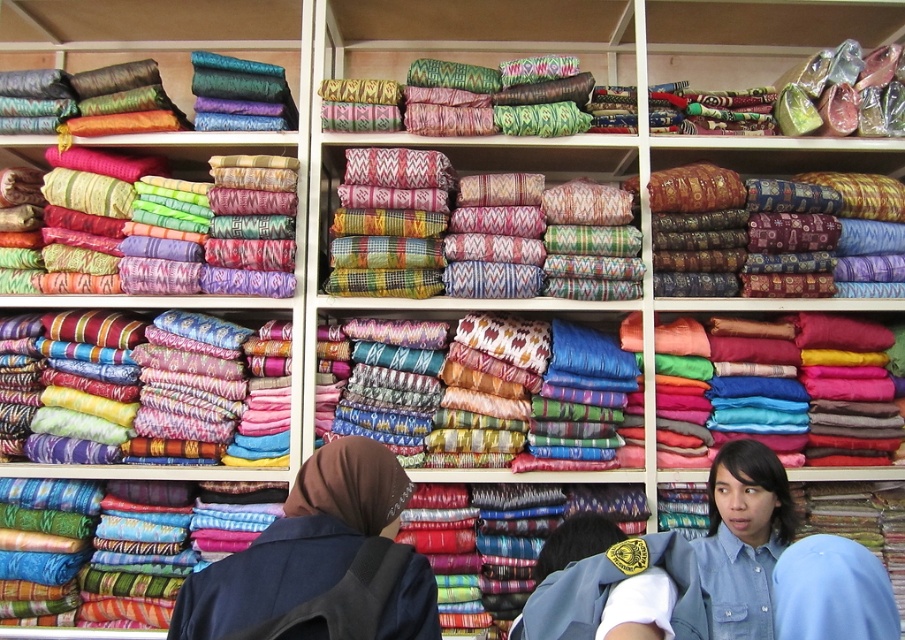
Is matte silk scarf at center above dark blue fabric at lower left?

Yes, matte silk scarf at center is above dark blue fabric at lower left.

Which of these two, matte silk scarf at center or dark blue fabric at lower left, stands taller?

matte silk scarf at center is taller.

Locate an element on the screen. matte silk scarf at center is located at coordinates (823, 381).